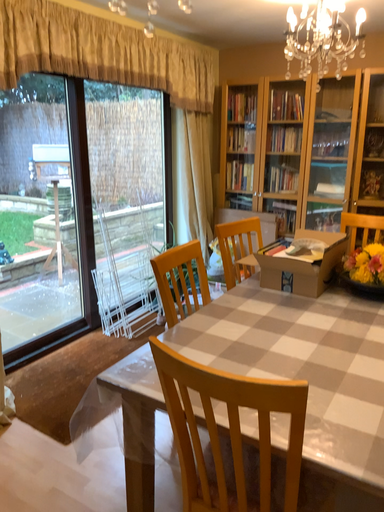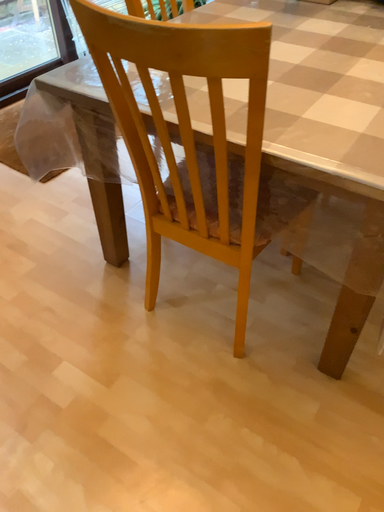
Question: Which way did the camera rotate in the video?

Choices:
 (A) rotated downward
 (B) rotated upward

Answer: (A)